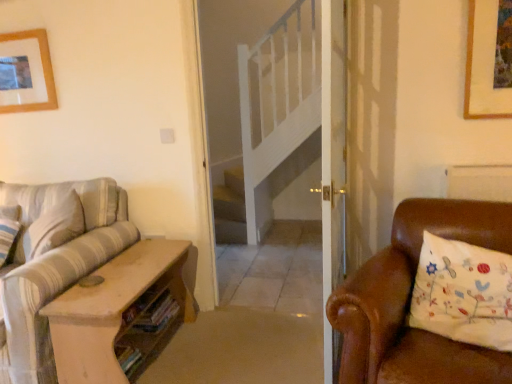
Locate an element on the screen. The image size is (512, 384). white embroidered pillow at right is located at coordinates (463, 293).

Is white embroidered pillow at right next to wooden picture frame at upper left?

They are not placed beside each other.

Which object is closer to the camera, white embroidered pillow at right or wooden picture frame at upper left?

white embroidered pillow at right is more forward.

Does white embroidered pillow at right appear on the right side of wooden picture frame at upper left?

Correct, you'll find white embroidered pillow at right to the right of wooden picture frame at upper left.

Which object is more forward, wooden picture frame at upper left or white embroidered pillow at right?

white embroidered pillow at right is in front.

From the image's perspective, is wooden picture frame at upper left below white embroidered pillow at right?

Actually, wooden picture frame at upper left appears above white embroidered pillow at right in the image.

From a real-world perspective, is wooden picture frame at upper left on top of striped fabric couch at left?

Indeed, from a real-world perspective, wooden picture frame at upper left stands above striped fabric couch at left.

Would you say striped fabric couch at left is part of wooden picture frame at upper left's contents?

That's incorrect, striped fabric couch at left is not inside wooden picture frame at upper left.

Consider the image. Can you confirm if wooden picture frame at upper left is positioned to the left of striped fabric couch at left?

Yes, wooden picture frame at upper left is to the left of striped fabric couch at left.

Does point (20, 95) come closer to viewer compared to point (7, 322)?

No, (20, 95) is further to viewer.

From the image's perspective, between striped fabric couch at left and white embroidered pillow at right, who is located below?

striped fabric couch at left, from the image's perspective.

Is white embroidered pillow at right at the back of striped fabric couch at left?

striped fabric couch at left is not turned away from white embroidered pillow at right.

How distant is striped fabric couch at left from white embroidered pillow at right?

striped fabric couch at left and white embroidered pillow at right are 1.52 meters apart from each other.

Based on the photo, relative to white embroidered pillow at right, is striped fabric couch at left in front or behind?

striped fabric couch at left is positioned farther from the viewer than white embroidered pillow at right.

From a real-world perspective, is white embroidered pillow at right located beneath striped fabric couch at left?

Incorrect, from a real-world perspective, white embroidered pillow at right is higher than striped fabric couch at left.

Considering the relative sizes of white embroidered pillow at right and striped fabric couch at left in the image provided, is white embroidered pillow at right smaller than striped fabric couch at left?

Correct, white embroidered pillow at right occupies less space than striped fabric couch at left.

Is white embroidered pillow at right at the left side of striped fabric couch at left?

Incorrect, white embroidered pillow at right is not on the left side of striped fabric couch at left.

Would you say striped fabric couch at left is outside wooden picture frame at upper left?

striped fabric couch at left lies outside wooden picture frame at upper left's area.

Find the location of a particular element. picture frame above the striped fabric couch at left (from a real-world perspective) is located at coordinates (26, 72).

Which is behind, striped fabric couch at left or wooden picture frame at upper left?

wooden picture frame at upper left is further away from the camera.

Does striped fabric couch at left have a larger size compared to wooden picture frame at upper left?

Correct, striped fabric couch at left is larger in size than wooden picture frame at upper left.

The image size is (512, 384). Identify the location of pillow to the right of wooden picture frame at upper left. (463, 293).

You are a GUI agent. You are given a task and a screenshot of the screen. Output one action in this format:
    pyautogui.click(x=<x>, y=<y>)
    Task: Click on the picture frame above the white embroidered pillow at right (from the image's perspective)
    This screenshot has height=384, width=512.
    Given the screenshot: What is the action you would take?
    pyautogui.click(x=26, y=72)

Considering their positions, is wooden picture frame at upper left positioned closer to white embroidered pillow at right than striped fabric couch at left?

striped fabric couch at left lies closer to white embroidered pillow at right than the other object.

Looking at the image, which one is located closer to wooden picture frame at upper left, striped fabric couch at left or white embroidered pillow at right?

striped fabric couch at left.

When comparing their distances from striped fabric couch at left, does white embroidered pillow at right or wooden picture frame at upper left seem further?

Among the two, white embroidered pillow at right is located further to striped fabric couch at left.

Considering their positions, is wooden picture frame at upper left positioned closer to striped fabric couch at left than white embroidered pillow at right?

wooden picture frame at upper left is positioned closer to the anchor striped fabric couch at left.

When comparing their distances from wooden picture frame at upper left, does white embroidered pillow at right or striped fabric couch at left seem further?

Based on the image, white embroidered pillow at right appears to be further to wooden picture frame at upper left.

Which object lies further to the anchor point white embroidered pillow at right, striped fabric couch at left or wooden picture frame at upper left?

wooden picture frame at upper left is positioned further to the anchor white embroidered pillow at right.

The width and height of the screenshot is (512, 384). What are the coordinates of `studio couch between wooden picture frame at upper left and white embroidered pillow at right` in the screenshot? It's located at (84, 286).